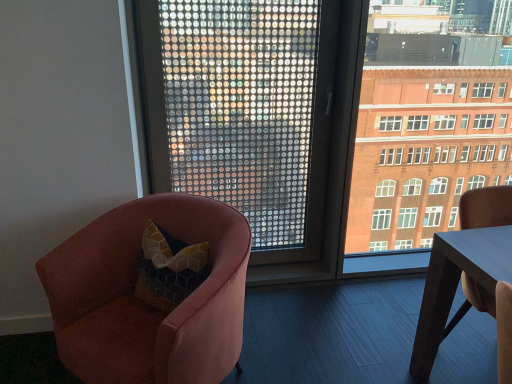
In order to face brick building at right, should I rotate leftwards or rightwards?

Turn right approximately 23.912 degrees to face it.

The image size is (512, 384). I want to click on velvet pink armchair at left, so click(143, 303).

Is velvet pink armchair at left facing away from transparent glass window at center?

Yes.

Can you tell me how much velvet pink armchair at left and transparent glass window at center differ in facing direction?

The angular difference between velvet pink armchair at left and transparent glass window at center is 43.1 degrees.

Is transparent glass window at center inside velvet pink armchair at left?

No, transparent glass window at center is not surrounded by velvet pink armchair at left.

Who is shorter, velvet pink armchair at left or transparent glass window at center?

velvet pink armchair at left is shorter.

Who is smaller, velvet pink armchair at left or smooth wooden table at right?

With smaller size is smooth wooden table at right.

Are velvet pink armchair at left and smooth wooden table at right located far from each other?

Yes.

Is point (124, 215) in front of point (490, 293)?

No, (124, 215) is behind (490, 293).

Is smooth wooden table at right a part of velvet pink armchair at left?

Actually, smooth wooden table at right is outside velvet pink armchair at left.

Is transparent glass window at center inside or outside of velvet pink armchair at left?

transparent glass window at center is not enclosed by velvet pink armchair at left.

In the image, is transparent glass window at center positioned in front of or behind velvet pink armchair at left?

transparent glass window at center is positioned farther from the viewer than velvet pink armchair at left.

Does transparent glass window at center have a lesser height compared to velvet pink armchair at left?

No, transparent glass window at center is not shorter than velvet pink armchair at left.

In the scene shown: Is transparent glass window at center beside velvet pink armchair at left?

No, transparent glass window at center is not next to velvet pink armchair at left.

Is smooth wooden table at right far from brick building at right?

That's not correct — smooth wooden table at right is a little close to brick building at right.

Is point (436, 302) positioned behind point (397, 140)?

No, (436, 302) is in front of (397, 140).

From the image's perspective, does smooth wooden table at right appear lower than brick building at right?

Indeed, from the image's perspective, smooth wooden table at right is shown beneath brick building at right.

In terms of width, does smooth wooden table at right look wider or thinner when compared to brick building at right?

smooth wooden table at right is wider than brick building at right.

Is transparent glass window at center looking in the opposite direction of brick building at right?

No, transparent glass window at center's orientation is not away from brick building at right.

Which object is wider, transparent glass window at center or brick building at right?

Wider between the two is brick building at right.

From the image's perspective, which one is positioned higher, transparent glass window at center or brick building at right?

From the image's view, brick building at right is above.

From a real-world perspective, is transparent glass window at center on brick building at right?

Yes, from a real-world perspective, transparent glass window at center is over brick building at right

From the image's perspective, is brick building at right below transparent glass window at center?

Actually, brick building at right appears above transparent glass window at center in the image.

Does point (370, 241) come in front of point (234, 93)?

No.

Considering the sizes of brick building at right and transparent glass window at center in the image, is brick building at right taller or shorter than transparent glass window at center?

brick building at right is taller than transparent glass window at center.

Where is `chair that appears below the brick building at right (from the image's perspective)`? This screenshot has height=384, width=512. chair that appears below the brick building at right (from the image's perspective) is located at coordinates (143, 303).

Between brick building at right and velvet pink armchair at left, which one appears on the right side from the viewer's perspective?

brick building at right.

Considering the sizes of objects brick building at right and velvet pink armchair at left in the image provided, who is wider, brick building at right or velvet pink armchair at left?

With larger width is velvet pink armchair at left.

Are brick building at right and velvet pink armchair at left far apart?

brick building at right is far away from velvet pink armchair at left.

Where is `chair below the transparent glass window at center (from the image's perspective)`? chair below the transparent glass window at center (from the image's perspective) is located at coordinates (143, 303).

I want to click on table above the velvet pink armchair at left (from a real-world perspective), so click(x=456, y=284).

Which object lies further to the anchor point transparent glass window at center, brick building at right or velvet pink armchair at left?

velvet pink armchair at left is further to transparent glass window at center.

Based on their spatial positions, is brick building at right or velvet pink armchair at left closer to smooth wooden table at right?

The object closer to smooth wooden table at right is brick building at right.

From the image, which object appears to be farther from brick building at right, transparent glass window at center or smooth wooden table at right?

The object further to brick building at right is smooth wooden table at right.

When comparing their distances from transparent glass window at center, does smooth wooden table at right or brick building at right seem closer?

brick building at right.

Considering their positions, is brick building at right positioned further to transparent glass window at center than smooth wooden table at right?

The object further to transparent glass window at center is smooth wooden table at right.

Considering their positions, is smooth wooden table at right positioned further to brick building at right than transparent glass window at center?

smooth wooden table at right is positioned further to the anchor brick building at right.

In the scene shown: When comparing their distances from brick building at right, does smooth wooden table at right or velvet pink armchair at left seem further?

Based on the image, velvet pink armchair at left appears to be further to brick building at right.

Estimate the real-world distances between objects in this image. Which object is further from smooth wooden table at right, transparent glass window at center or brick building at right?

Among the two, transparent glass window at center is located further to smooth wooden table at right.

Identify the location of window between velvet pink armchair at left and brick building at right in the horizontal direction. (243, 111).

Where is `window located between velvet pink armchair at left and smooth wooden table at right in the left-right direction`? The image size is (512, 384). window located between velvet pink armchair at left and smooth wooden table at right in the left-right direction is located at coordinates (243, 111).

Locate an element on the screen. condominium between transparent glass window at center and smooth wooden table at right from left to right is located at coordinates (425, 150).

Where is `condominium between velvet pink armchair at left and smooth wooden table at right in the horizontal direction`? The width and height of the screenshot is (512, 384). condominium between velvet pink armchair at left and smooth wooden table at right in the horizontal direction is located at coordinates (425, 150).